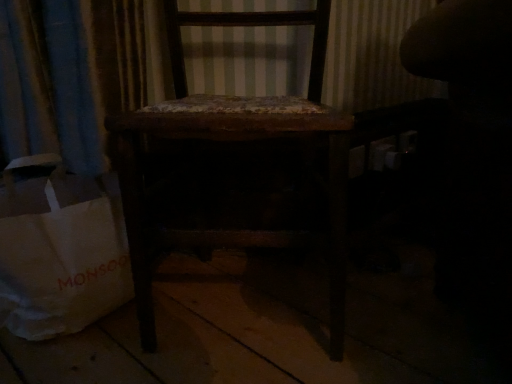
You are a GUI agent. You are given a task and a screenshot of the screen. Output one action in this format:
    pyautogui.click(x=<x>, y=<y>)
    Task: Click on the white paper bag at lower left
    Image resolution: width=512 pixels, height=384 pixels.
    Given the screenshot: What is the action you would take?
    pyautogui.click(x=60, y=250)

This screenshot has width=512, height=384. Describe the element at coordinates (60, 250) in the screenshot. I see `white paper bag at lower left` at that location.

In order to face dark wood chair at center, should I rotate leftwards or rightwards?

To face it directly, rotate left by 1.861 degrees.

What do you see at coordinates (234, 140) in the screenshot?
I see `dark wood chair at center` at bounding box center [234, 140].

Where is `dark wood chair at center`? dark wood chair at center is located at coordinates (234, 140).

The width and height of the screenshot is (512, 384). In order to click on white paper bag at lower left in this screenshot , I will do `click(60, 250)`.

Which is more to the left, dark wood chair at center or white paper bag at lower left?

white paper bag at lower left is more to the left.

Is dark wood chair at center closer to the viewer compared to white paper bag at lower left?

Yes, it is.

Which point is more distant from viewer, [334,296] or [68,322]?

The point [68,322] is behind.

From the image's perspective, is dark wood chair at center below white paper bag at lower left?

Incorrect, from the image's perspective, dark wood chair at center is higher than white paper bag at lower left.

In the scene shown: From a real-world perspective, is dark wood chair at center physically above white paper bag at lower left?

Indeed, from a real-world perspective, dark wood chair at center stands above white paper bag at lower left.

Does dark wood chair at center have a lesser width compared to white paper bag at lower left?

No.

Is dark wood chair at center shorter than white paper bag at lower left?

In fact, dark wood chair at center may be taller than white paper bag at lower left.

Considering the sizes of dark wood chair at center and white paper bag at lower left in the image, is dark wood chair at center bigger or smaller than white paper bag at lower left?

Considering their sizes, dark wood chair at center takes up more space than white paper bag at lower left.

Is dark wood chair at center surrounding white paper bag at lower left?

No, white paper bag at lower left is not a part of dark wood chair at center.

Is dark wood chair at center not near white paper bag at lower left?

They are positioned close to each other.

Is dark wood chair at center facing away from white paper bag at lower left?

No.

This screenshot has height=384, width=512. In the image, there is a dark wood chair at center. In order to click on grocery bag below it (from the image's perspective) in this screenshot , I will do `click(60, 250)`.

Between white paper bag at lower left and dark wood chair at center, which one appears on the right side from the viewer's perspective?

dark wood chair at center.

Considering the positions of objects white paper bag at lower left and dark wood chair at center in the image provided, who is in front, white paper bag at lower left or dark wood chair at center?

dark wood chair at center is in front.

Does point (122, 229) come behind point (256, 105)?

Yes.

From the image's perspective, is white paper bag at lower left located beneath dark wood chair at center?

Yes.

Based on the photo, from a real-world perspective, which is physically above, white paper bag at lower left or dark wood chair at center?

From a 3D spatial view, dark wood chair at center is above.

In terms of width, does white paper bag at lower left look wider or thinner when compared to dark wood chair at center?

Considering their sizes, white paper bag at lower left looks slimmer than dark wood chair at center.

Is white paper bag at lower left taller or shorter than dark wood chair at center?

In the image, white paper bag at lower left appears to be shorter than dark wood chair at center.

Is white paper bag at lower left bigger than dark wood chair at center?

Incorrect, white paper bag at lower left is not larger than dark wood chair at center.

Which is correct: white paper bag at lower left is inside dark wood chair at center, or outside of it?

white paper bag at lower left is outside dark wood chair at center.

Looking at this image, is white paper bag at lower left positioned far away from dark wood chair at center?

No.

Is dark wood chair at center at the back of white paper bag at lower left?

white paper bag at lower left is not turned away from dark wood chair at center.

Can you tell me how much white paper bag at lower left and dark wood chair at center differ in facing direction?

There is a 11.5-degree angle between the facing directions of white paper bag at lower left and dark wood chair at center.

Identify the location of grocery bag below the dark wood chair at center (from the image's perspective). The height and width of the screenshot is (384, 512). (60, 250).

You are a GUI agent. You are given a task and a screenshot of the screen. Output one action in this format:
    pyautogui.click(x=<x>, y=<y>)
    Task: Click on the grocery bag below the dark wood chair at center (from the image's perspective)
    
    Given the screenshot: What is the action you would take?
    pyautogui.click(x=60, y=250)

Where is `grocery bag located behind the dark wood chair at center`? The image size is (512, 384). grocery bag located behind the dark wood chair at center is located at coordinates (60, 250).